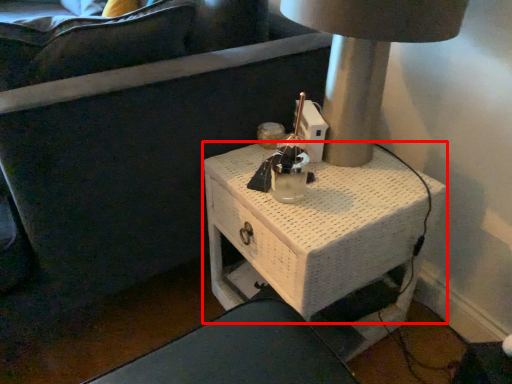
Question: From the image's perspective, considering the relative positions of table (annotated by the red box) and table lamp in the image provided, where is table (annotated by the red box) located with respect to the staircase?

Choices:
 (A) above
 (B) below

Answer: (B)